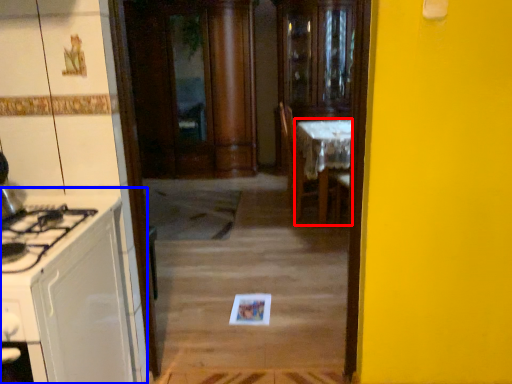
Question: Which of the following is the farthest to the observer, table (highlighted by a red box) or cabinetry (highlighted by a blue box)?

Choices:
 (A) table
 (B) cabinetry

Answer: (A)